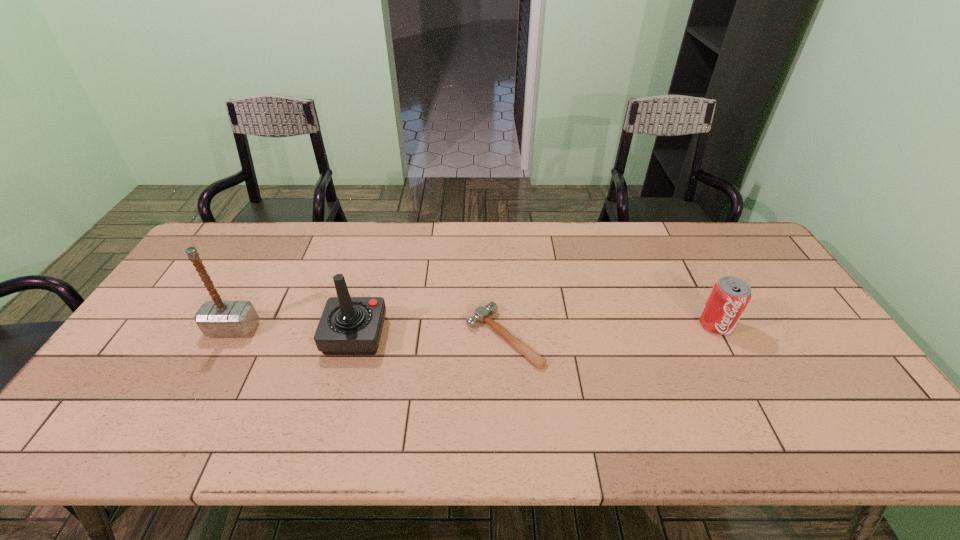
I want to click on unoccupied position between the right hammer and the second object from left to right, so click(x=429, y=336).

Identify the location of vacant region between the joystick and the shortest object. Image resolution: width=960 pixels, height=540 pixels. (429, 336).

Identify the location of free space between the rightmost object and the second object from right to left. (610, 331).

Choose which object is the third nearest neighbor to the right hammer. Please provide its 2D coordinates. Your answer should be formatted as a tuple, i.e. [(x, y)], where the tuple contains the x and y coordinates of a point satisfying the conditions above.

[(217, 318)]

This screenshot has height=540, width=960. I want to click on object identified as the closest to the second object from right to left, so click(348, 325).

You are a GUI agent. You are given a task and a screenshot of the screen. Output one action in this format:
    pyautogui.click(x=<x>, y=<y>)
    Task: Click on the vacant region that satisfies the following two spatial constraints: 1. on the front side of the third tallest object; 2. on the front-facing side of the joystick
    This screenshot has width=960, height=540.
    Given the screenshot: What is the action you would take?
    (x=721, y=335)

This screenshot has width=960, height=540. Identify the location of vacant space that satisfies the following two spatial constraints: 1. on the front-facing side of the right hammer; 2. on the left side of the third shortest object. (354, 337).

What are the coordinates of `free spot that satisfies the following two spatial constraints: 1. on the back side of the shorter hammer; 2. on the front-facing side of the second tallest object` in the screenshot? It's located at (504, 335).

This screenshot has height=540, width=960. Find the location of `vacant space that satisfies the following two spatial constraints: 1. on the striking surface of the shortest object; 2. on the left side of the tallest object`. vacant space that satisfies the following two spatial constraints: 1. on the striking surface of the shortest object; 2. on the left side of the tallest object is located at coordinates (228, 337).

Where is `vacant point that satisfies the following two spatial constraints: 1. on the back side of the third object from left to right; 2. on the front-facing side of the third object from right to left`? vacant point that satisfies the following two spatial constraints: 1. on the back side of the third object from left to right; 2. on the front-facing side of the third object from right to left is located at coordinates (x=504, y=335).